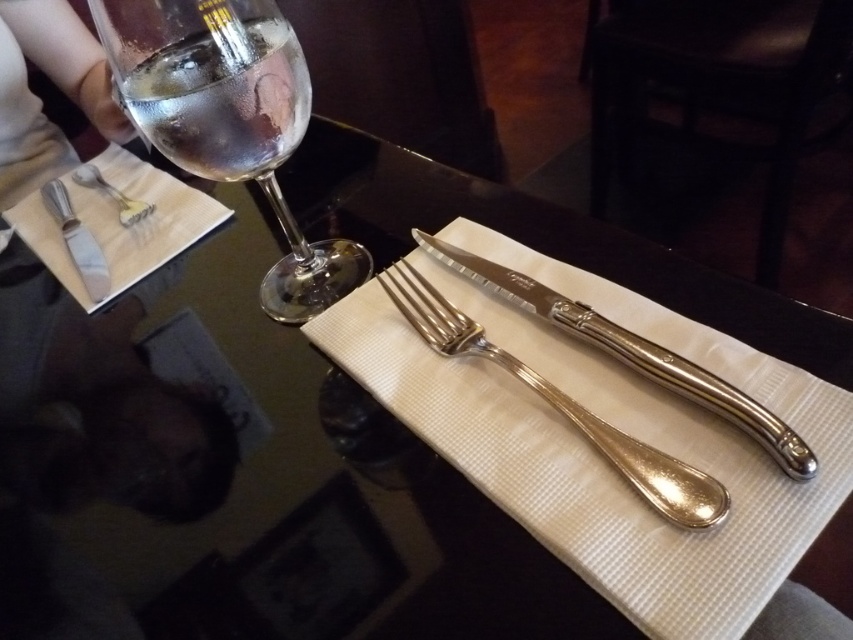
Question: Among these objects, which one is farthest from the camera?

Choices:
 (A) polished silver fork at upper left
 (B) polished silver knife at upper left

Answer: (A)

Question: Is clear glass wine glass at upper left positioned at the back of polished silver fork at upper left?

Choices:
 (A) no
 (B) yes

Answer: (A)

Question: Can you confirm if clear glass wine at upper left is bigger than polished silver fork at center?

Choices:
 (A) yes
 (B) no

Answer: (B)

Question: Is polished silver knife at upper left smaller than polished silver fork at upper left?

Choices:
 (A) no
 (B) yes

Answer: (A)

Question: Considering the real-world distances, which object is closest to the polished silver fork at upper left?

Choices:
 (A) clear glass wine at upper left
 (B) polished silver fork at center
 (C) polished silver knife at upper left
 (D) clear glass wine glass at upper left

Answer: (C)

Question: Which of the following is the farthest from the observer?

Choices:
 (A) (85, 240)
 (B) (242, 83)

Answer: (A)